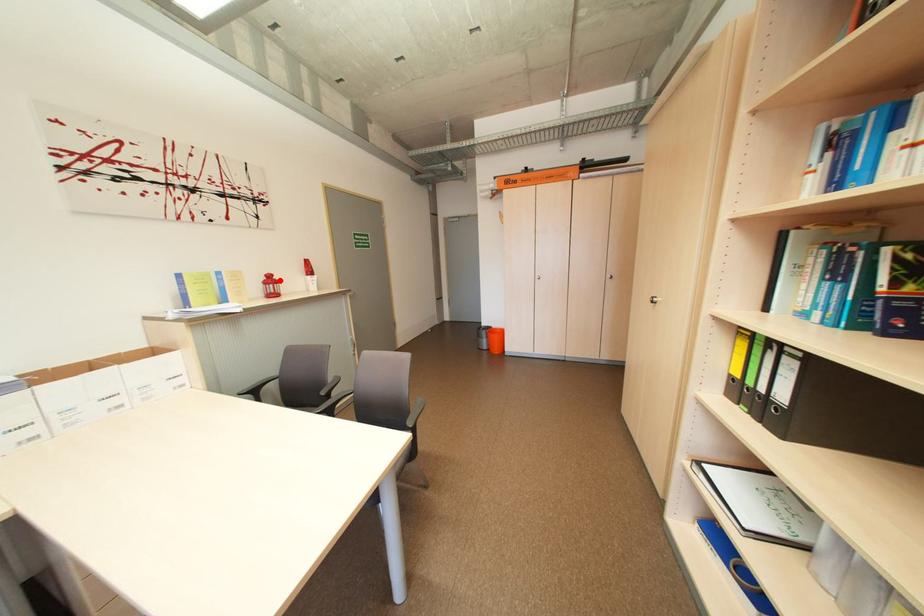
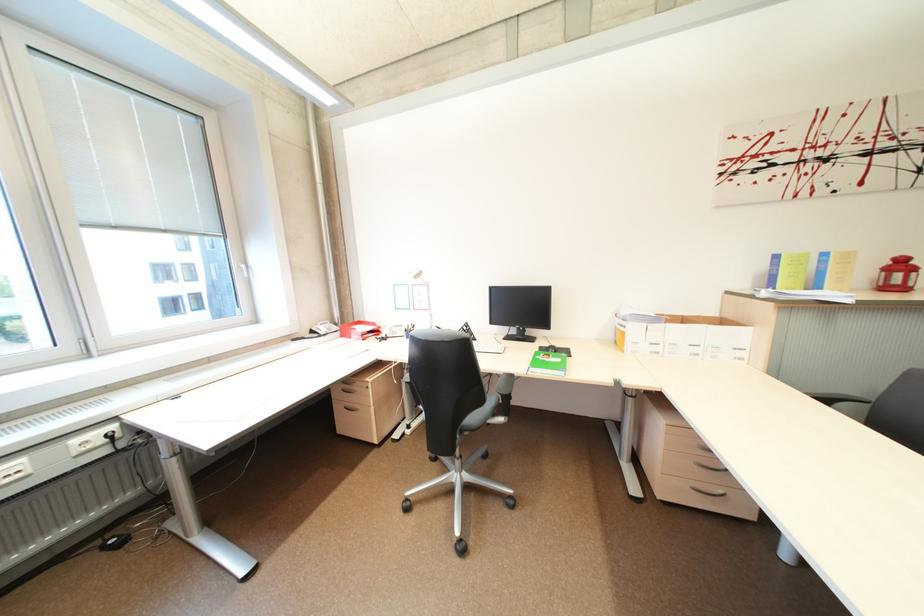
Locate, in the second image, the point that corresponds to the highlighted location in the first image.

(910, 265)